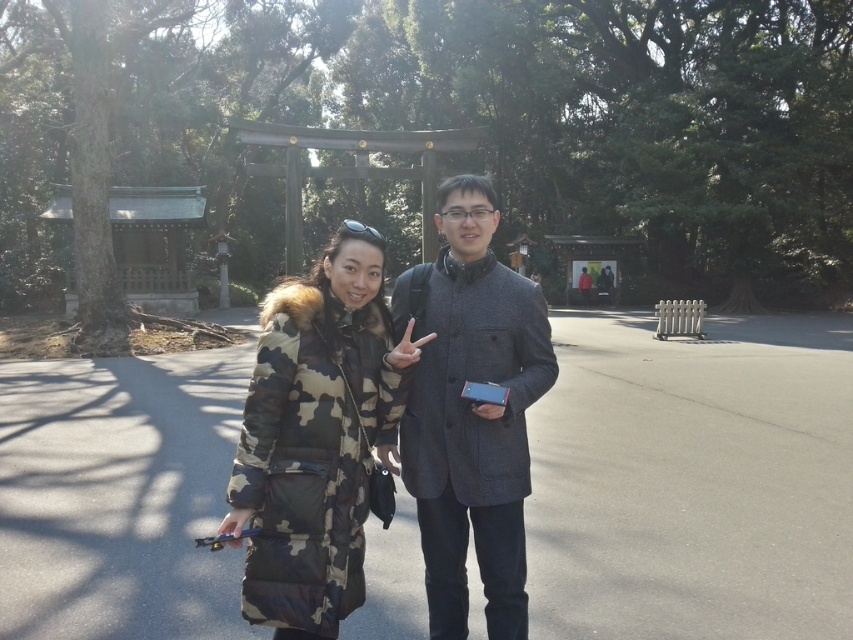
You are a photographer trying to frame two coats in a photo shoot. You have the camo fabric coat at center and the gray wool coat at center. If you want to arrange them side by side so that the wider coat takes up more horizontal space in the frame, which coat should you place on the left?

The camo fabric coat at center is wider than the gray wool coat at center, so you should place the camo fabric coat at center on the left to take up more horizontal space in the frame.

You are a photographer trying to position two markers on the image. The first marker should be placed at point (325, 464) and the second at point (453, 396). Which marker will appear closer to the camera in the photo?

Point (325, 464) is closer to the viewer than point (453, 396), so the first marker placed at point (325, 464) will appear closer to the camera in the photo.